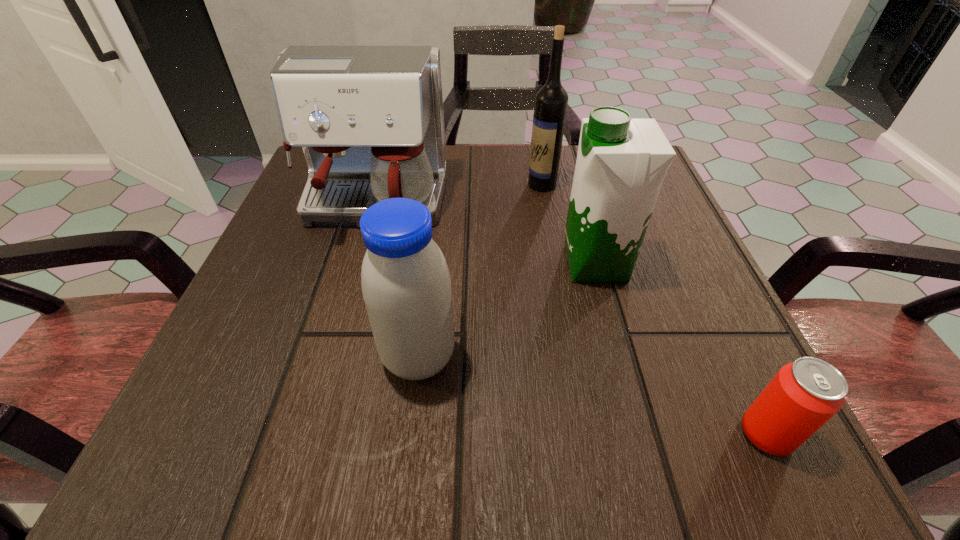
Identify the location of vacant area that satisfies the following two spatial constraints: 1. on the front of the coffee maker near the spout; 2. on the left side of the rightmost object. The width and height of the screenshot is (960, 540). tap(305, 434).

Find the location of a particular element. This screenshot has width=960, height=540. free spot that satisfies the following two spatial constraints: 1. on the front of the nearest object near the spout; 2. on the right side of the coffee maker is located at coordinates (305, 434).

The width and height of the screenshot is (960, 540). Find the location of `free space that satisfies the following two spatial constraints: 1. on the front-facing side of the rightmost object; 2. on the left side of the right soya milk`. free space that satisfies the following two spatial constraints: 1. on the front-facing side of the rightmost object; 2. on the left side of the right soya milk is located at coordinates (642, 434).

Where is `vacant position in the image that satisfies the following two spatial constraints: 1. on the front of the coffee maker near the spout; 2. on the right side of the nearest object`? vacant position in the image that satisfies the following two spatial constraints: 1. on the front of the coffee maker near the spout; 2. on the right side of the nearest object is located at coordinates pos(305,434).

At what (x,y) coordinates should I click in order to perform the action: click on vacant space that satisfies the following two spatial constraints: 1. on the front of the coffee maker near the spout; 2. on the left side of the left soya milk. Please return your answer as a coordinate pair (x, y). The width and height of the screenshot is (960, 540). Looking at the image, I should click on (327, 357).

Identify the location of vacant region that satisfies the following two spatial constraints: 1. on the front of the left soya milk near the spout; 2. on the left side of the coffee maker. (327, 357).

The image size is (960, 540). What are the coordinates of `vacant space that satisfies the following two spatial constraints: 1. on the front of the nearer soya milk near the spout; 2. on the right side of the coffee maker` in the screenshot? It's located at (327, 357).